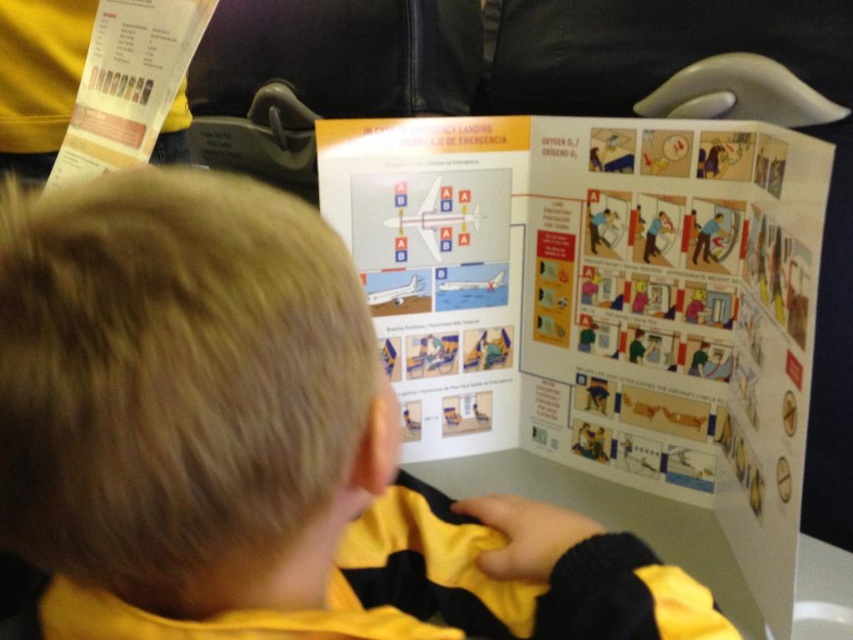
From the picture: Is yellow fabric shirt at upper center wider than white paper at upper left?

Correct, the width of yellow fabric shirt at upper center exceeds that of white paper at upper left.

What do you see at coordinates (254, 444) in the screenshot? I see `yellow fabric shirt at upper center` at bounding box center [254, 444].

The width and height of the screenshot is (853, 640). I want to click on yellow fabric shirt at upper center, so click(x=254, y=444).

Where is `yellow fabric shirt at upper center`? The image size is (853, 640). yellow fabric shirt at upper center is located at coordinates (254, 444).

Between white paper at center and white paper at upper left, which one is positioned lower?

white paper at center is below.

Which of these two, white paper at center or white paper at upper left, stands shorter?

Standing shorter between the two is white paper at upper left.

Where is `white paper at center`? Image resolution: width=853 pixels, height=640 pixels. white paper at center is located at coordinates (601, 317).

Which of these two, yellow fabric shirt at upper center or white paper at center, stands taller?

white paper at center is taller.

Image resolution: width=853 pixels, height=640 pixels. I want to click on yellow fabric shirt at upper center, so click(x=254, y=444).